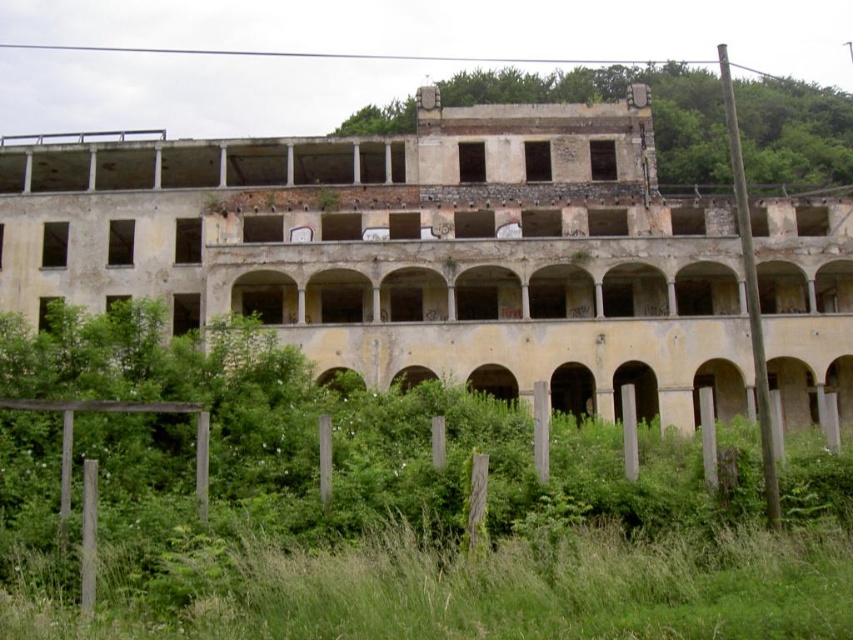
Question: Which point is farther to the camera?

Choices:
 (A) green grass at center
 (B) green grass at lower center

Answer: (A)

Question: Which object appears closest to the camera in this image?

Choices:
 (A) green grass at center
 (B) green grass at lower center

Answer: (B)

Question: Is green grass at lower center further to camera compared to green grass at center?

Choices:
 (A) yes
 (B) no

Answer: (B)

Question: Can you confirm if green grass at lower center is positioned to the right of green grass at center?

Choices:
 (A) yes
 (B) no

Answer: (B)

Question: Is green grass at lower center smaller than green grass at center?

Choices:
 (A) yes
 (B) no

Answer: (A)

Question: Which point appears farthest from the camera in this image?

Choices:
 (A) (538, 102)
 (B) (213, 636)

Answer: (A)